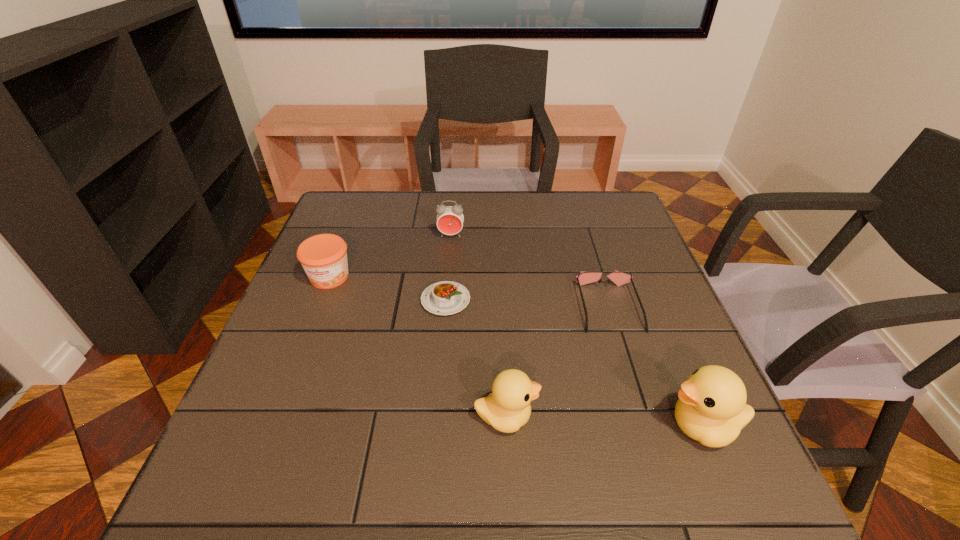
The image size is (960, 540). Find the location of `vacant space that satisfies the following two spatial constraints: 1. on the bridge of the sunglasses; 2. on the face of the left duck`. vacant space that satisfies the following two spatial constraints: 1. on the bridge of the sunglasses; 2. on the face of the left duck is located at coordinates (643, 417).

The image size is (960, 540). Find the location of `vacant region that satisfies the following two spatial constraints: 1. on the face of the farthest object; 2. on the left side of the pudding`. vacant region that satisfies the following two spatial constraints: 1. on the face of the farthest object; 2. on the left side of the pudding is located at coordinates (445, 300).